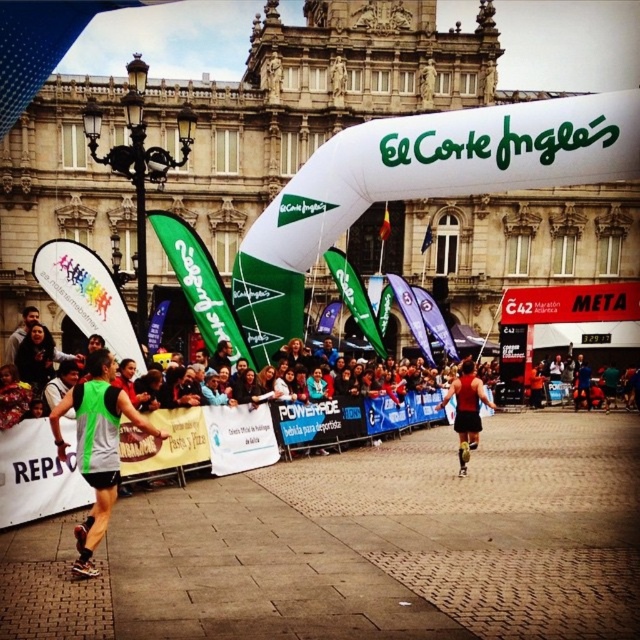
Can you confirm if green fabric vest at left is positioned below red matte tank top at center?

Indeed, green fabric vest at left is positioned under red matte tank top at center.

Locate an element on the screen. The height and width of the screenshot is (640, 640). green fabric vest at left is located at coordinates (97, 445).